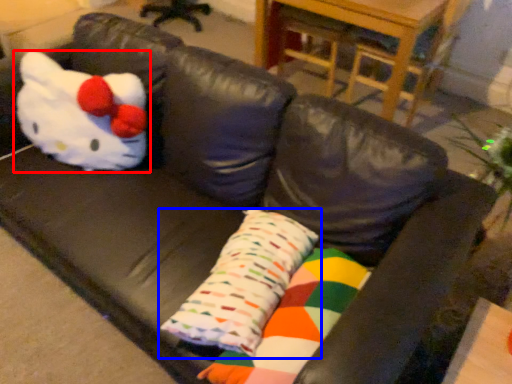
Question: Which object appears farthest to the camera in this image, toy (highlighted by a red box) or pillow (highlighted by a blue box)?

Choices:
 (A) toy
 (B) pillow

Answer: (A)